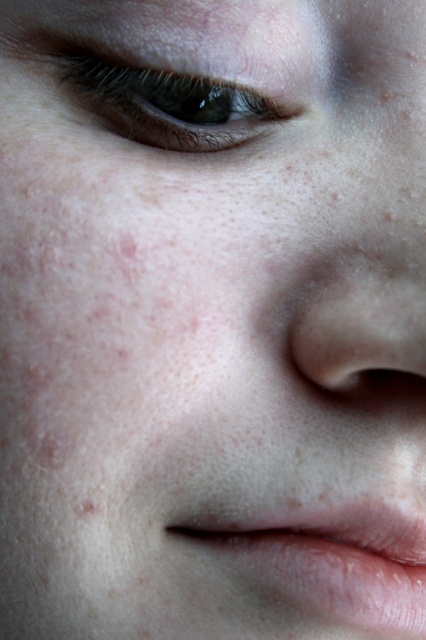
Question: Can you confirm if pink smooth lips at lower center is positioned to the left of brown matte eye at upper left?

Choices:
 (A) yes
 (B) no

Answer: (B)

Question: Does pink smooth lips at lower center come in front of smooth skin nose at center?

Choices:
 (A) yes
 (B) no

Answer: (B)

Question: Which of the following is the farthest from the observer?

Choices:
 (A) (345, 595)
 (B) (190, 120)

Answer: (B)

Question: Which of the following is the farthest from the observer?

Choices:
 (A) (374, 605)
 (B) (213, 138)
 (C) (353, 289)

Answer: (B)

Question: Can you confirm if pink smooth lips at lower center is positioned to the right of smooth skin nose at center?

Choices:
 (A) yes
 (B) no

Answer: (B)

Question: Which of the following is the closest to the observer?

Choices:
 (A) (198, 131)
 (B) (400, 298)
 (C) (380, 524)

Answer: (B)